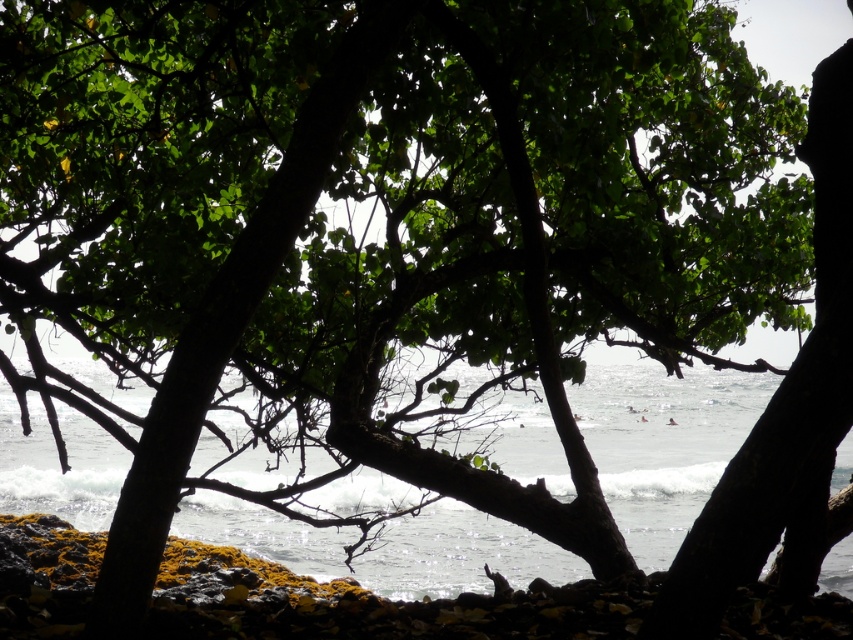
You are standing in front of the tree and want to find the clear water at center. According to the coordinates provided, where should you look relative to the tree?

The clear water at center is located at coordinates point [663,444], which means it is positioned to the right and slightly below the center of the image. Since the tree is in the foreground occupying the upper part, you should look towards the lower right area beyond the tree silhouette to find the clear water at center.

You are standing in front of a tree that frames a view of the ocean. A specific point in the scene has coordinates point (x=659, y=442). If you want to reach that point, which direction should you move relative to your current position?

The point (x=659, y=442) is 21.06 meters away from the camera, so you should move forward towards the ocean to reach it.

You are a photographer standing in front of the tree. You want to capture the green mossy rocks at lower center and the clear water at center in your photo. Which object should you focus on first to ensure both are in the frame?

The clear water at center is in front of green mossy rocks at lower center, so you should focus on the clear water at center first to ensure both are in the frame.